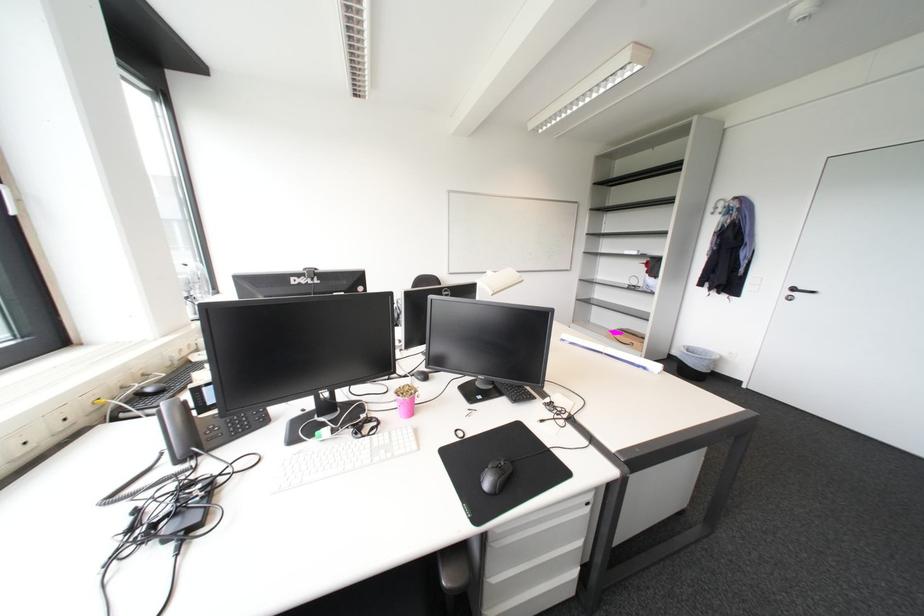
The image size is (924, 616). What do you see at coordinates (454, 569) in the screenshot?
I see `a chair armrest` at bounding box center [454, 569].